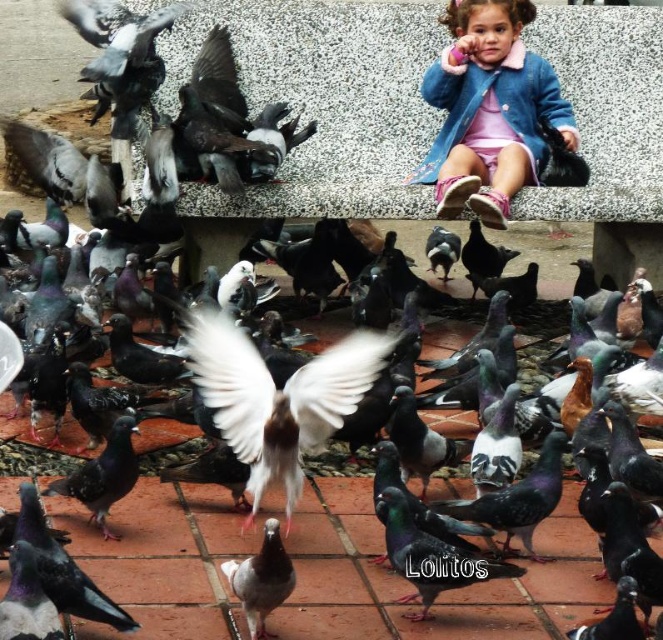
Based on the photo, you are a photographer trying to capture the speckled feathered pigeon at center in the image. Based on its 2D coordinates, where should you position your camera to ensure it is centered in the frame?

To center the speckled feathered pigeon at center, position your camera so that the crosshairs align with the coordinates point (x=432, y=556).

You are a photographer trying to capture the child and the pigeons in the scene. You notice two points marked in the image. The first point is at coordinates point (202,330) and the second point is at point (452,566). Which point is closer to your camera lens?

Point (202,330) is further to the camera than point (452,566), so the point closer to the camera lens is point (202,330).